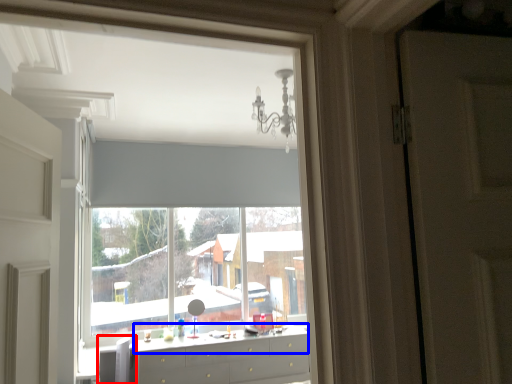
Question: Which object is closer to the camera taking this photo, swivel chair (highlighted by a red box) or counter top (highlighted by a blue box)?

Choices:
 (A) swivel chair
 (B) counter top

Answer: (A)